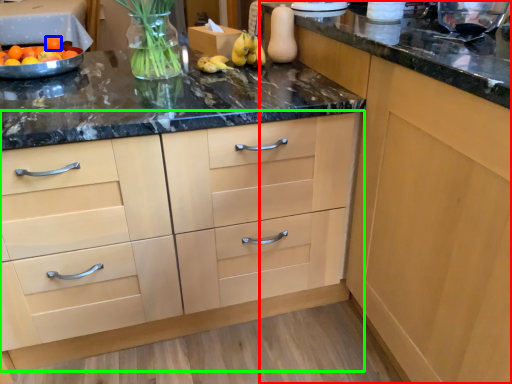
Question: Which object is positioned farthest from cabinetry (highlighted by a red box)? Select from tangerine (highlighted by a blue box) and cabinetry (highlighted by a green box).

Choices:
 (A) tangerine
 (B) cabinetry

Answer: (A)